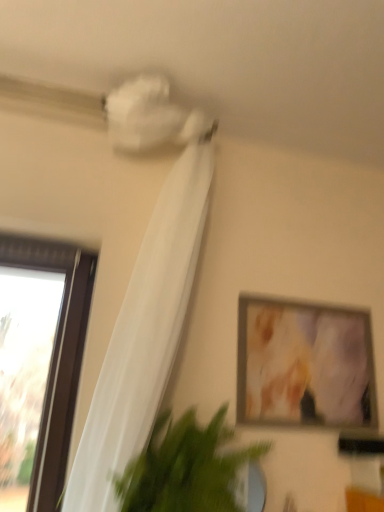
Question: Can you confirm if matte wooden picture frame at upper right is positioned to the left of green leafy plant at lower left?

Choices:
 (A) no
 (B) yes

Answer: (A)

Question: Is matte wooden picture frame at upper right facing towards green leafy plant at lower left?

Choices:
 (A) no
 (B) yes

Answer: (A)

Question: Can you confirm if matte wooden picture frame at upper right is positioned to the right of green leafy plant at lower left?

Choices:
 (A) yes
 (B) no

Answer: (A)

Question: From a real-world perspective, is matte wooden picture frame at upper right beneath green leafy plant at lower left?

Choices:
 (A) no
 (B) yes

Answer: (A)

Question: From a real-world perspective, is matte wooden picture frame at upper right on green leafy plant at lower left?

Choices:
 (A) no
 (B) yes

Answer: (B)

Question: Is green leafy plant at lower left wider or thinner than white sheer curtain at upper left?

Choices:
 (A) wide
 (B) thin

Answer: (A)

Question: Considering the relative positions of green leafy plant at lower left and white sheer curtain at upper left in the image provided, is green leafy plant at lower left to the left or to the right of white sheer curtain at upper left?

Choices:
 (A) left
 (B) right

Answer: (B)

Question: Does point [248, 448] appear closer or farther from the camera than point [137, 442]?

Choices:
 (A) closer
 (B) farther

Answer: (B)

Question: From the image's perspective, is green leafy plant at lower left positioned above or below white sheer curtain at upper left?

Choices:
 (A) below
 (B) above

Answer: (A)

Question: Considering the positions of green leafy plant at lower left and matte wooden picture frame at upper right in the image, is green leafy plant at lower left bigger or smaller than matte wooden picture frame at upper right?

Choices:
 (A) small
 (B) big

Answer: (B)

Question: Considering the relative positions of green leafy plant at lower left and matte wooden picture frame at upper right in the image provided, is green leafy plant at lower left to the left or to the right of matte wooden picture frame at upper right?

Choices:
 (A) left
 (B) right

Answer: (A)

Question: In terms of height, does green leafy plant at lower left look taller or shorter compared to matte wooden picture frame at upper right?

Choices:
 (A) tall
 (B) short

Answer: (B)

Question: From the image's perspective, is green leafy plant at lower left positioned above or below matte wooden picture frame at upper right?

Choices:
 (A) above
 (B) below

Answer: (B)

Question: Is point (112, 352) closer or farther from the camera than point (185, 497)?

Choices:
 (A) closer
 (B) farther

Answer: (B)

Question: From their relative heights in the image, would you say white sheer curtain at upper left is taller or shorter than green leafy plant at lower left?

Choices:
 (A) tall
 (B) short

Answer: (A)